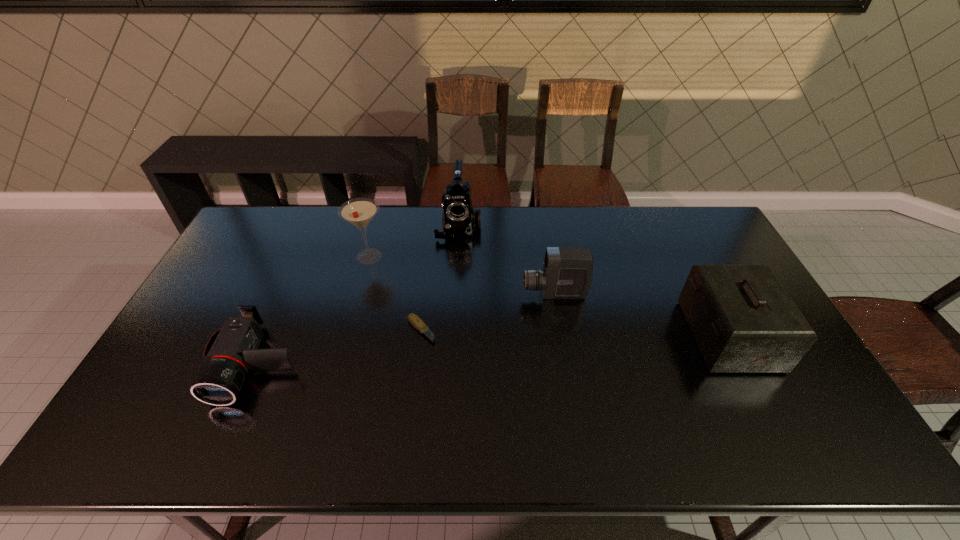
You are a GUI agent. You are given a task and a screenshot of the screen. Output one action in this format:
    pyautogui.click(x=<x>, y=<y>)
    Task: Click on the object situated at the left edge
    
    Given the screenshot: What is the action you would take?
    pyautogui.click(x=232, y=351)

In order to click on object that is at the right edge in this screenshot , I will do `click(743, 321)`.

The width and height of the screenshot is (960, 540). Find the location of `vacant space at the far edge of the desktop`. vacant space at the far edge of the desktop is located at coordinates (404, 230).

Where is `free region at the near edge of the desktop`? Image resolution: width=960 pixels, height=540 pixels. free region at the near edge of the desktop is located at coordinates (409, 438).

Find the location of a particular element. blank space at the left edge of the desktop is located at coordinates (188, 317).

The height and width of the screenshot is (540, 960). What are the coordinates of `free location at the far right corner of the desktop` in the screenshot? It's located at (706, 246).

Find the location of `free space at the near right corner of the desktop`. free space at the near right corner of the desktop is located at coordinates (806, 434).

This screenshot has width=960, height=540. I want to click on vacant area that lies between the martini and the pocketknife, so click(x=395, y=293).

Where is `vacant space that's between the rightmost camcorder and the second shortest object`? Image resolution: width=960 pixels, height=540 pixels. vacant space that's between the rightmost camcorder and the second shortest object is located at coordinates click(406, 328).

At what (x,y) coordinates should I click in order to perform the action: click on free point between the first-aid kit and the pocketknife. Please return your answer as a coordinate pair (x, y). The width and height of the screenshot is (960, 540). Looking at the image, I should click on coord(574,333).